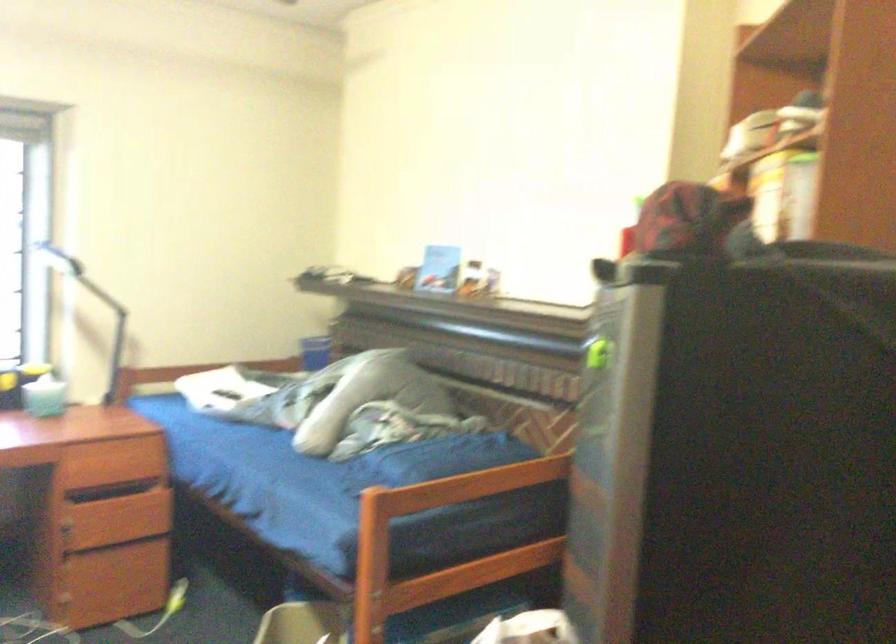
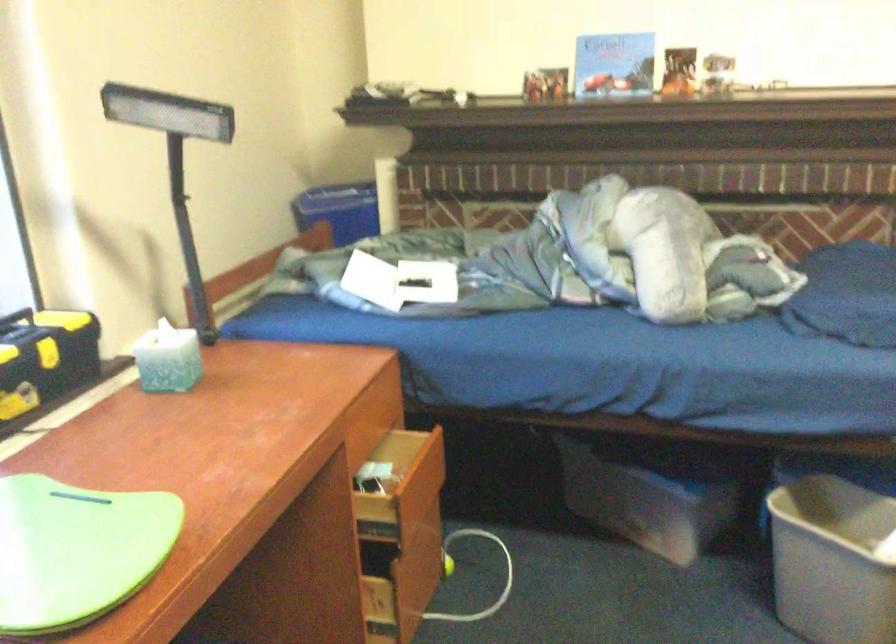
Locate, in the second image, the point that corresponds to point (168, 286) in the first image.

(176, 162)